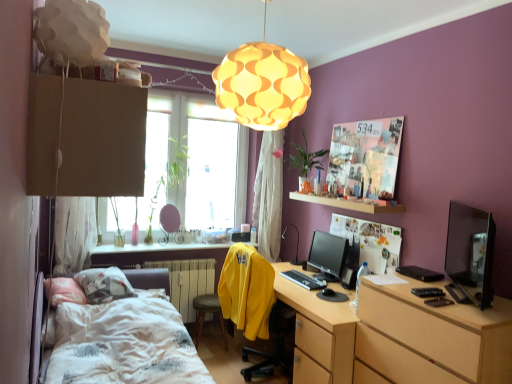
What is the approximate width of white sheer curtain at center, the second curtain positioned from the left?

The width of white sheer curtain at center, the second curtain positioned from the left, is 10.28 inches.

Locate an element on the screen. This screenshot has height=384, width=512. wooden at upper center is located at coordinates (349, 204).

What is the approximate width of wooden at upper center?

It is 10.35 inches.

Where is `transparent glass window at center`? The width and height of the screenshot is (512, 384). transparent glass window at center is located at coordinates (191, 165).

Measure the distance from yellow fabric lampshade at upper center to matte paper collage at upper right, the 2th poster page from the bottom.

yellow fabric lampshade at upper center and matte paper collage at upper right, the 2th poster page from the bottom, are 1.10 meters apart.

Is point (295, 65) closer or farther from the camera than point (331, 172)?

Point (295, 65) is closer to the camera than point (331, 172).

Can you confirm if yellow fabric lampshade at upper center is wider than matte paper collage at upper right, the 2th poster page from the bottom?

Correct, the width of yellow fabric lampshade at upper center exceeds that of matte paper collage at upper right, the 2th poster page from the bottom.

The width and height of the screenshot is (512, 384). What are the coordinates of `lamp in front of the matte paper collage at upper right, the 2th poster page from the bottom` in the screenshot? It's located at (262, 84).

Is yellow fabric lampshade at upper center positioned before brown leather stool at center?

Yes, it is.

Does yellow fabric lampshade at upper center appear on the left side of brown leather stool at center?

Incorrect, yellow fabric lampshade at upper center is not on the left side of brown leather stool at center.

Are yellow fabric lampshade at upper center and brown leather stool at center located far from each other?

Indeed, yellow fabric lampshade at upper center is not near brown leather stool at center.

From a real-world perspective, is transparent glass window at center above or below yellow fabric chair at center?

From a real-world perspective, transparent glass window at center is physically above yellow fabric chair at center.

Considering the points (190, 144) and (255, 264), which point is behind, point (190, 144) or point (255, 264)?

Point (190, 144)

Are transparent glass window at center and yellow fabric chair at center far apart?

Indeed, transparent glass window at center is not near yellow fabric chair at center.

Is transparent glass window at center looking in the opposite direction of yellow fabric chair at center?

That's not correct — transparent glass window at center is not looking away from yellow fabric chair at center.

Do you think black matte keyboard at center is within matte black table lamp at center, or outside of it?

The correct answer is: outside.

In the image, is black matte keyboard at center positioned in front of or behind matte black table lamp at center?

Clearly, black matte keyboard at center is in front of matte black table lamp at center.

From the image's perspective, does black matte keyboard at center appear lower than matte black table lamp at center?

Yes, from the image's perspective, black matte keyboard at center is below matte black table lamp at center.

From a real-world perspective, is black matte keyboard at center located higher than matte black table lamp at center?

Incorrect, from a real-world perspective, black matte keyboard at center is lower than matte black table lamp at center.

Who is smaller, matte paper poster at upper center, which is counted as the 1th poster page, starting from the bottom, or yellow fabric chair at center?

matte paper poster at upper center, which is counted as the 1th poster page, starting from the bottom, is smaller.

From the image's perspective, relative to yellow fabric chair at center, is matte paper poster at upper center, which is counted as the second poster page, starting from the top, above or below?

Based on their image positions, matte paper poster at upper center, which is counted as the second poster page, starting from the top, is located above yellow fabric chair at center.

Considering the relative positions of matte paper poster at upper center, which is counted as the second poster page, starting from the top, and yellow fabric chair at center in the image provided, is matte paper poster at upper center, which is counted as the second poster page, starting from the top, in front of yellow fabric chair at center?

Yes, matte paper poster at upper center, which is counted as the second poster page, starting from the top, is in front of yellow fabric chair at center.

Is yellow fabric chair at center inside matte paper poster at upper center, which is counted as the second poster page, starting from the top?

No, yellow fabric chair at center is located outside of matte paper poster at upper center, which is counted as the second poster page, starting from the top.

From the picture: How many degrees apart are the facing directions of matte black monitor at center and matte black table lamp at center?

There is a 25.6-degree angle between the facing directions of matte black monitor at center and matte black table lamp at center.

Does matte black monitor at center appear on the right side of matte black table lamp at center?

Yes, matte black monitor at center is to the right of matte black table lamp at center.

Between point (330, 261) and point (298, 247), which one is positioned in front?

The point (330, 261) is closer.

Does yellow fabric chair at center have a smaller size compared to white sheer curtain at left, the second curtain when ordered from back to front?

No, yellow fabric chair at center is not smaller than white sheer curtain at left, the second curtain when ordered from back to front.

From a real-world perspective, is yellow fabric chair at center over white sheer curtain at left, which ranks as the 1th curtain in front-to-back order?

No, from a real-world perspective, yellow fabric chair at center is not over white sheer curtain at left, which ranks as the 1th curtain in front-to-back order

From the image's perspective, which is below, yellow fabric chair at center or white sheer curtain at left, which ranks as the 1th curtain in front-to-back order?

yellow fabric chair at center appears lower in the image.

Is yellow fabric chair at center behind white sheer curtain at left, positioned as the 2th curtain in right-to-left order?

No, yellow fabric chair at center is closer to the viewer.

You are a GUI agent. You are given a task and a screenshot of the screen. Output one action in this format:
    pyautogui.click(x=<x>, y=<y>)
    Task: Click on the lamp above the matte paper collage at upper right, the 2th poster page from the bottom (from a real-world perspective)
    This screenshot has width=512, height=384.
    Given the screenshot: What is the action you would take?
    pyautogui.click(x=262, y=84)

Identify the location of lamp above the brown leather stool at center (from the image's perspective). (262, 84).

Based on the photo, estimate the real-world distances between objects in this image. Which object is further from matte black monitor at center, yellow fabric chair at center or black glossy monitor at right?

The object further to matte black monitor at center is black glossy monitor at right.

Estimate the real-world distances between objects in this image. Which object is further from yellow fabric chair at center, matte black monitor at center or white sheer curtain at left, arranged as the 1th curtain when viewed from the left?

Among the two, white sheer curtain at left, arranged as the 1th curtain when viewed from the left, is located further to yellow fabric chair at center.

Looking at the image, which one is located further to matte paper poster at upper center, which is counted as the 1th poster page, starting from the bottom, black matte keyboard at center or matte paper collage at upper right, the 2th poster page from the bottom?

Among the two, black matte keyboard at center is located further to matte paper poster at upper center, which is counted as the 1th poster page, starting from the bottom.

Which object lies nearer to the anchor point white textured bed at lower left, yellow fabric lampshade at upper center or wooden desk at center?

wooden desk at center lies closer to white textured bed at lower left than the other object.

Based on the photo, looking at the image, which one is located closer to yellow fabric lampshade at upper center, black glossy monitor at right or white textured bed at lower left?

black glossy monitor at right lies closer to yellow fabric lampshade at upper center than the other object.

When comparing their distances from matte paper collage at upper right, which is the 1th poster page in top-to-bottom order, does white sheer curtain at center, the first curtain when ordered from back to front, or black glossy monitor at right seem further?

white sheer curtain at center, the first curtain when ordered from back to front, is further to matte paper collage at upper right, which is the 1th poster page in top-to-bottom order.

Based on their spatial positions, is white textured bed at lower left or wooden at upper center further from white sheer curtain at center, which appears as the first curtain when viewed from the right?

The object further to white sheer curtain at center, which appears as the first curtain when viewed from the right, is white textured bed at lower left.

Looking at the image, which one is located further to wooden desk at center, yellow fabric lampshade at upper center or white sheer curtain at center, which is the second curtain in front-to-back order?

Based on the image, yellow fabric lampshade at upper center appears to be further to wooden desk at center.

In order to click on desktop computer between yellow fabric lampshade at upper center and yellow fabric chair at center in the up-down direction in this screenshot , I will do `click(471, 252)`.

This screenshot has width=512, height=384. I want to click on desk between transparent glass window at center and brown leather stool at center from top to bottom, so click(x=322, y=319).

This screenshot has height=384, width=512. In order to click on table lamp between yellow fabric lampshade at upper center and transparent glass window at center in the front-back direction in this screenshot , I will do `click(297, 243)`.

Locate an element on the screen. This screenshot has height=384, width=512. stool between black glossy monitor at right and white sheer curtain at center, which appears as the first curtain when viewed from the right, in the front-back direction is located at coordinates (208, 312).